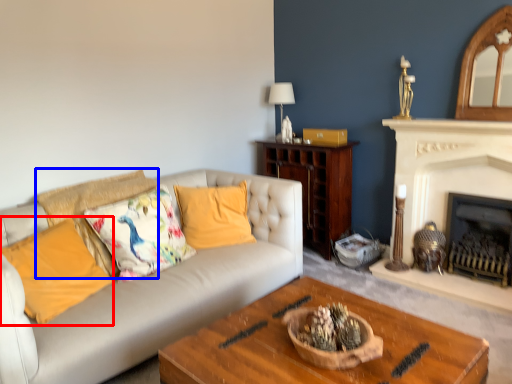
Question: Which of the following is the closest to the observer, pillow (highlighted by a red box) or pillow (highlighted by a blue box)?

Choices:
 (A) pillow
 (B) pillow

Answer: (A)